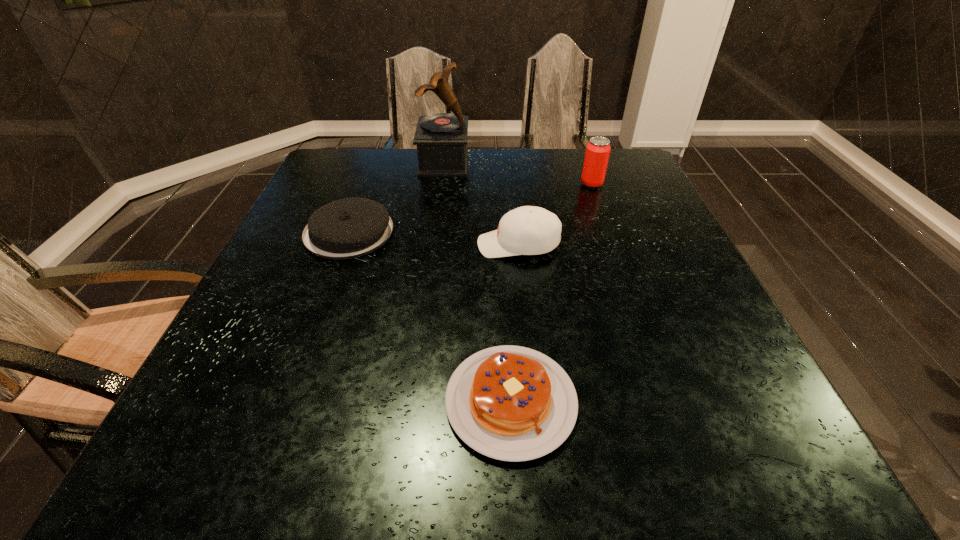
Locate an element on the screen. the farthest object is located at coordinates (441, 138).

Locate an element on the screen. This screenshot has height=540, width=960. phonograph_record is located at coordinates (441, 138).

This screenshot has height=540, width=960. Find the location of `the second farthest object`. the second farthest object is located at coordinates (598, 149).

This screenshot has width=960, height=540. I want to click on the rightmost object, so click(598, 149).

Locate an element on the screen. The width and height of the screenshot is (960, 540). the third tallest object is located at coordinates (528, 230).

You are a GUI agent. You are given a task and a screenshot of the screen. Output one action in this format:
    pyautogui.click(x=<x>, y=<y>)
    Task: Click on the leftmost object
    
    Given the screenshot: What is the action you would take?
    pyautogui.click(x=348, y=228)

In order to click on the second shortest object in this screenshot , I will do 348,228.

This screenshot has height=540, width=960. What are the coordinates of `the nearest object` in the screenshot? It's located at 511,403.

Locate an element on the screen. The width and height of the screenshot is (960, 540). the shortest object is located at coordinates point(511,403).

The height and width of the screenshot is (540, 960). I want to click on free spot located 0.210m at the horn opening of the phonograph_record, so click(x=539, y=162).